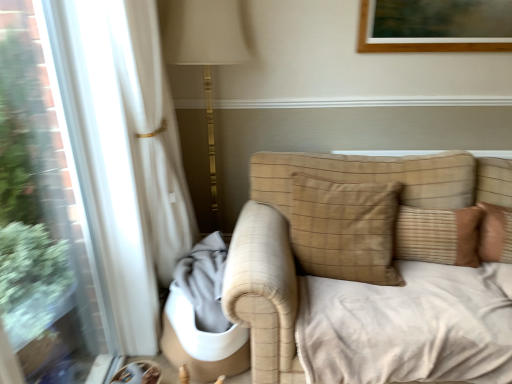
Question: Based on their sizes in the image, would you say brown textured pillow at center, the second pillow positioned from the left, is bigger or smaller than beige textured pillow at center, placed as the 1th pillow when sorted from left to right?

Choices:
 (A) small
 (B) big

Answer: (A)

Question: Relative to beige textured pillow at center, which is counted as the 2th pillow, starting from the right, is brown textured pillow at center, the second pillow positioned from the left, in front or behind?

Choices:
 (A) behind
 (B) front

Answer: (A)

Question: Looking at their shapes, would you say brown textured pillow at center, the second pillow positioned from the left, is wider or thinner than beige textured pillow at center, which is counted as the 2th pillow, starting from the right?

Choices:
 (A) thin
 (B) wide

Answer: (A)

Question: In terms of width, does beige textured pillow at center, which is counted as the 2th pillow, starting from the right, look wider or thinner when compared to brown textured pillow at center, which is the 1th pillow from right to left?

Choices:
 (A) wide
 (B) thin

Answer: (A)

Question: Is beige textured pillow at center, placed as the 1th pillow when sorted from left to right, to the left or to the right of brown textured pillow at center, the second pillow positioned from the left, in the image?

Choices:
 (A) left
 (B) right

Answer: (A)

Question: Is beige textured pillow at center, which is counted as the 2th pillow, starting from the right, taller or shorter than brown textured pillow at center, which is the 1th pillow from right to left?

Choices:
 (A) tall
 (B) short

Answer: (A)

Question: Do you think beige textured pillow at center, which is counted as the 2th pillow, starting from the right, is within brown textured pillow at center, the second pillow positioned from the left, or outside of it?

Choices:
 (A) inside
 (B) outside

Answer: (B)